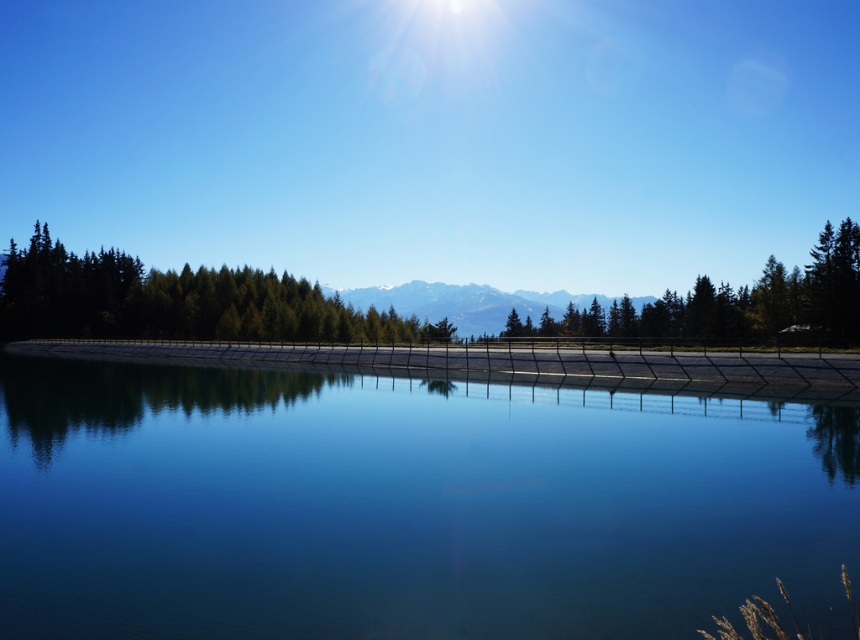
Question: Which is farther from the green matte trees at center?

Choices:
 (A) green matte tree at center
 (B) snowy white mountain at center

Answer: (B)

Question: Observing the image, what is the correct spatial positioning of green matte trees at center in reference to green matte tree at center?

Choices:
 (A) left
 (B) right

Answer: (A)

Question: Which point is closer to the camera?

Choices:
 (A) green matte trees at center
 (B) snowy white mountain at center
 (C) green matte tree at center

Answer: (C)

Question: Is green matte trees at center to the left of green matte tree at center from the viewer's perspective?

Choices:
 (A) yes
 (B) no

Answer: (A)

Question: Can you confirm if transparent glass water at center is bigger than snowy white mountain at center?

Choices:
 (A) yes
 (B) no

Answer: (B)

Question: Which point is closer to the camera taking this photo?

Choices:
 (A) coord(776,560)
 (B) coord(475,285)
 (C) coord(5,298)

Answer: (A)